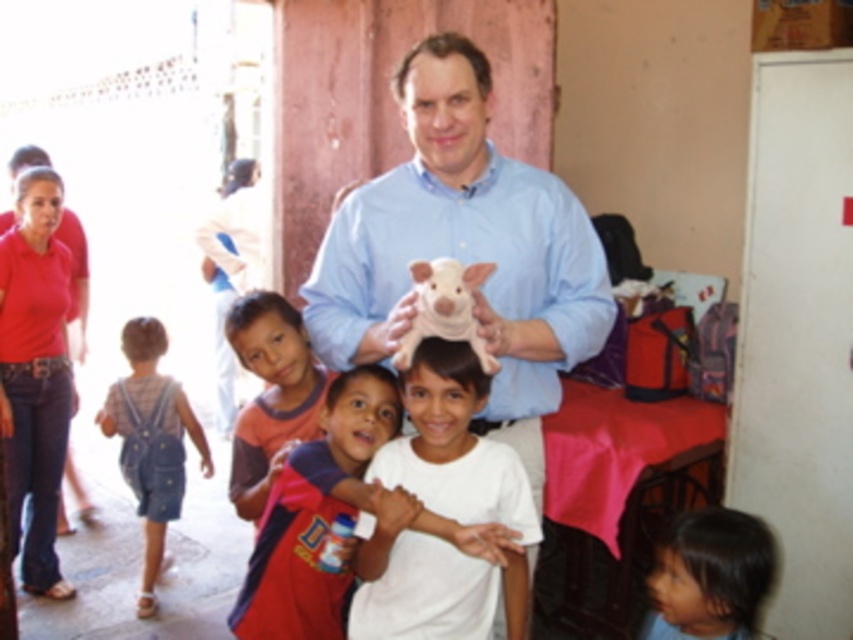
You are a photographer trying to capture a group photo of everyone in the scene. You notice the orange cotton shirt at lower left and the denim overalls at left. Which person should you position closer to the front to ensure both are visible?

The orange cotton shirt at lower left is shorter than the denim overalls at left, so you should position the orange cotton shirt at lower left closer to the front to ensure both are visible.